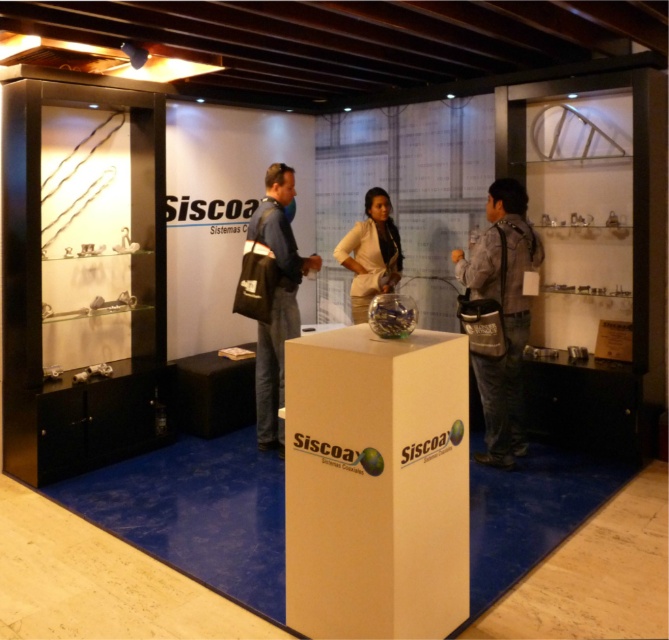
You are a visitor at the exhibition and want to pick up both the gray fabric bag at right and the dark blue fabric jacket at center. If you can carry items within 5 feet of each other, can you pick them up without moving either item?

The gray fabric bag at right is 4.34 feet from the dark blue fabric jacket at center. Since 4.34 feet is less than 5 feet, you can pick them up without moving either item.

You are a visitor at the exhibition booth and want to pick up the gray fabric bag at right. Where should you look relative to the beige fabric jacket at center?

The gray fabric bag at right is located below the beige fabric jacket at center, so you should look downward from the beige fabric jacket at center to find it.

You are standing at the entrance of the Siscoa Sistemas Coaxiales exhibition booth. You notice two points marked on the floor. The first point is at coordinates point (266, 324) and the second is at point (375, 200). If you want to move towards the point that is closer to you, which coordinate should you head towards?

Point (266, 324) is in front of point (375, 200), so you should head towards point (266, 324) as it is closer to your current position at the entrance.